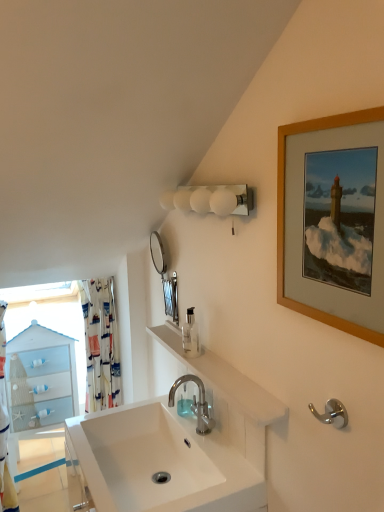
Question: Can white frosted glass sconce at upper center be found inside polished chrome hook at lower right?

Choices:
 (A) no
 (B) yes

Answer: (A)

Question: Can you confirm if polished chrome hook at lower right is thinner than white frosted glass sconce at upper center?

Choices:
 (A) yes
 (B) no

Answer: (A)

Question: Is polished chrome hook at lower right shorter than white frosted glass sconce at upper center?

Choices:
 (A) yes
 (B) no

Answer: (A)

Question: Is polished chrome hook at lower right wider than white frosted glass sconce at upper center?

Choices:
 (A) no
 (B) yes

Answer: (A)

Question: Can you confirm if polished chrome hook at lower right is bigger than white frosted glass sconce at upper center?

Choices:
 (A) yes
 (B) no

Answer: (B)

Question: From the image's perspective, is polished chrome faucet at center positioned above or below polished chrome hook at lower right?

Choices:
 (A) below
 (B) above

Answer: (A)

Question: From a real-world perspective, is polished chrome faucet at center physically located above or below polished chrome hook at lower right?

Choices:
 (A) below
 (B) above

Answer: (A)

Question: In terms of height, does polished chrome faucet at center look taller or shorter compared to polished chrome hook at lower right?

Choices:
 (A) tall
 (B) short

Answer: (A)

Question: Is point (192, 403) positioned closer to the camera than point (327, 403)?

Choices:
 (A) closer
 (B) farther

Answer: (B)

Question: Would you say wooden picture frame at upper right is inside or outside white fabric shower curtain at left, the first shower curtain when ordered from left to right?

Choices:
 (A) inside
 (B) outside

Answer: (B)

Question: Considering the positions of wooden picture frame at upper right and white fabric shower curtain at left, the first shower curtain when ordered from left to right, in the image, is wooden picture frame at upper right wider or thinner than white fabric shower curtain at left, the first shower curtain when ordered from left to right,?

Choices:
 (A) wide
 (B) thin

Answer: (B)

Question: From the image's perspective, is wooden picture frame at upper right above or below white fabric shower curtain at left, the first shower curtain when ordered from left to right?

Choices:
 (A) below
 (B) above

Answer: (B)

Question: Considering the relative positions of wooden picture frame at upper right and white fabric shower curtain at left, the first shower curtain when ordered from left to right, in the image provided, is wooden picture frame at upper right to the left or to the right of white fabric shower curtain at left, the first shower curtain when ordered from left to right,?

Choices:
 (A) left
 (B) right

Answer: (B)

Question: Considering their positions, is white fabric shower curtain at left, the 2th shower curtain positioned from the right, located in front of or behind silver metallic mirror at upper center?

Choices:
 (A) behind
 (B) front

Answer: (A)

Question: In terms of width, does white fabric shower curtain at left, the first shower curtain when ordered from left to right, look wider or thinner when compared to silver metallic mirror at upper center?

Choices:
 (A) wide
 (B) thin

Answer: (A)